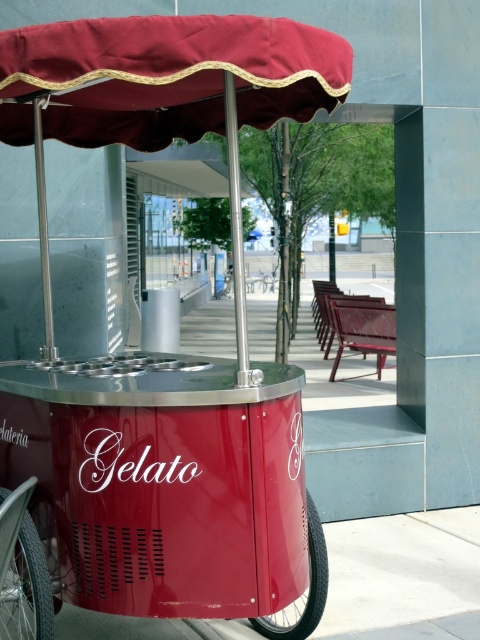
Question: Which point appears farthest from the camera in this image?

Choices:
 (A) (1, 531)
 (B) (312, 593)
 (C) (277, 592)

Answer: (B)

Question: Observing the image, what is the correct spatial positioning of maroon fabric canopy at upper center in reference to silver metallic wheel at lower left?

Choices:
 (A) right
 (B) left

Answer: (A)

Question: Is the position of shiny red gelato cart at left less distant than that of maroon fabric canopy at upper center?

Choices:
 (A) no
 (B) yes

Answer: (A)

Question: Among these objects, which one is farthest from the camera?

Choices:
 (A) maroon fabric canopy at upper center
 (B) shiny red gelato cart at left
 (C) shiny red gelato cart at center

Answer: (C)

Question: Does shiny red gelato cart at left appear on the right side of maroon fabric canopy at upper center?

Choices:
 (A) no
 (B) yes

Answer: (B)

Question: Which object is closer to the camera taking this photo?

Choices:
 (A) silver metallic wheel at lower left
 (B) maroon fabric canopy at upper center
 (C) shiny red gelato cart at left

Answer: (B)